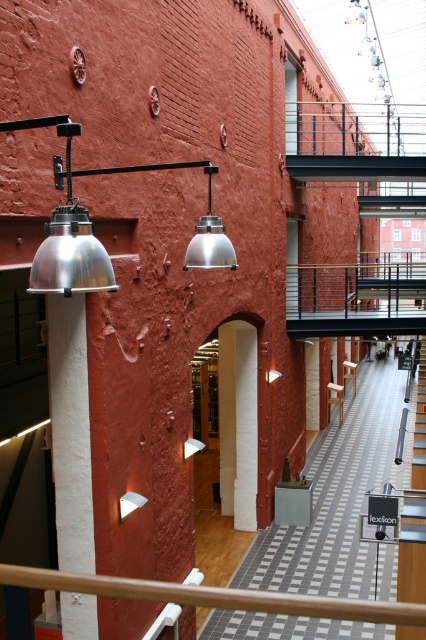
You are a visitor in this library and want to place a small potted plant between the white matte pillar at center and the light brown wooden stool at center. Which object should the plant be closer to if it needs to be closer to the smaller object?

The white matte pillar at center is smaller than the light brown wooden stool at center, so the plant should be placed closer to the white matte pillar at center.

You are an architect reviewing the library design. You need to install a new sensor on the taller structure between the white painted concrete pillar at left and the metallic staircase at center. Which structure should you choose?

The metallic staircase at center is taller than the white painted concrete pillar at left, so you should install the sensor on the metallic staircase at center.

You are standing in the library and want to move from the point at coordinates (x=69, y=557) to the point at coordinates (x=331, y=403). Which direction should you move?

You should move backward because point (x=69, y=557) is in front of point (x=331, y=403).